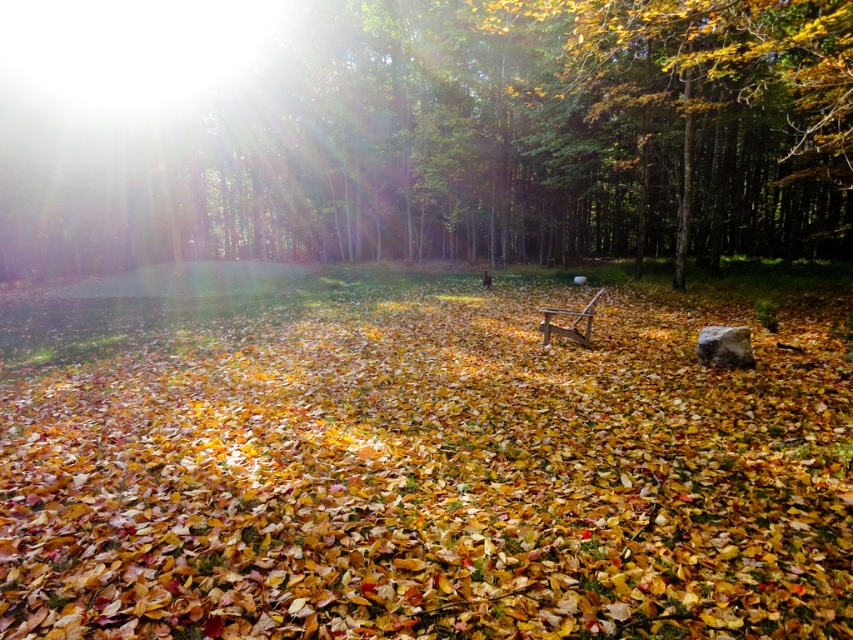
You are a hiker carrying a backpack and need to sit down to rest. You see the multicolored leaf litter at center and the wooden bench at center. Which one is closer to you?

The wooden bench at center is closer to you than the multicolored leaf litter at center, so you can sit on the wooden bench at center.

You are standing in the autumn forest clearing and want to sit down. You see the green matte tree at center and the wooden bench at center. Which object is closer to you where you can reach it easily?

The green matte tree at center is closer to the viewer than the wooden bench at center, so you can reach it more easily.